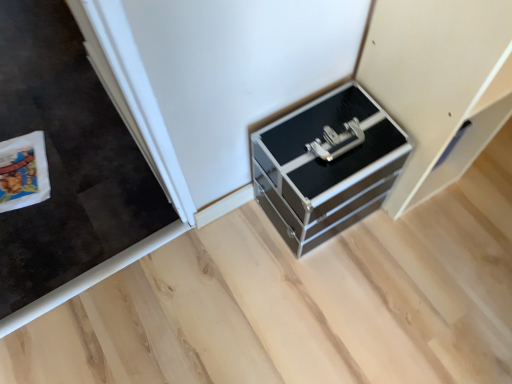
Question: From a real-world perspective, is metallic silver drawer at lower right physically above metallic black chest of drawers at center?

Choices:
 (A) no
 (B) yes

Answer: (B)

Question: Is metallic silver drawer at lower right further to camera compared to metallic black chest of drawers at center?

Choices:
 (A) yes
 (B) no

Answer: (B)

Question: From a real-world perspective, is metallic silver drawer at lower right under metallic black chest of drawers at center?

Choices:
 (A) no
 (B) yes

Answer: (A)

Question: Considering the relative sizes of metallic silver drawer at lower right and metallic black chest of drawers at center in the image provided, is metallic silver drawer at lower right taller than metallic black chest of drawers at center?

Choices:
 (A) no
 (B) yes

Answer: (B)

Question: From the image's perspective, would you say metallic silver drawer at lower right is shown under metallic black chest of drawers at center?

Choices:
 (A) no
 (B) yes

Answer: (A)

Question: Does metallic silver drawer at lower right appear on the left side of metallic black chest of drawers at center?

Choices:
 (A) no
 (B) yes

Answer: (A)

Question: Does metallic black chest of drawers at center have a lesser height compared to metallic silver drawer at lower right?

Choices:
 (A) yes
 (B) no

Answer: (A)

Question: Does metallic black chest of drawers at center lie in front of metallic silver drawer at lower right?

Choices:
 (A) yes
 (B) no

Answer: (B)

Question: Would you say metallic black chest of drawers at center is a long distance from metallic silver drawer at lower right?

Choices:
 (A) no
 (B) yes

Answer: (A)

Question: Is metallic black chest of drawers at center smaller than metallic silver drawer at lower right?

Choices:
 (A) yes
 (B) no

Answer: (A)

Question: Is metallic black chest of drawers at center at the left side of metallic silver drawer at lower right?

Choices:
 (A) no
 (B) yes

Answer: (B)

Question: Would you say metallic silver drawer at lower right is part of metallic black chest of drawers at center's contents?

Choices:
 (A) yes
 (B) no

Answer: (B)

Question: From the image's perspective, relative to metallic silver drawer at lower right, is metallic black chest of drawers at center above or below?

Choices:
 (A) above
 (B) below

Answer: (B)